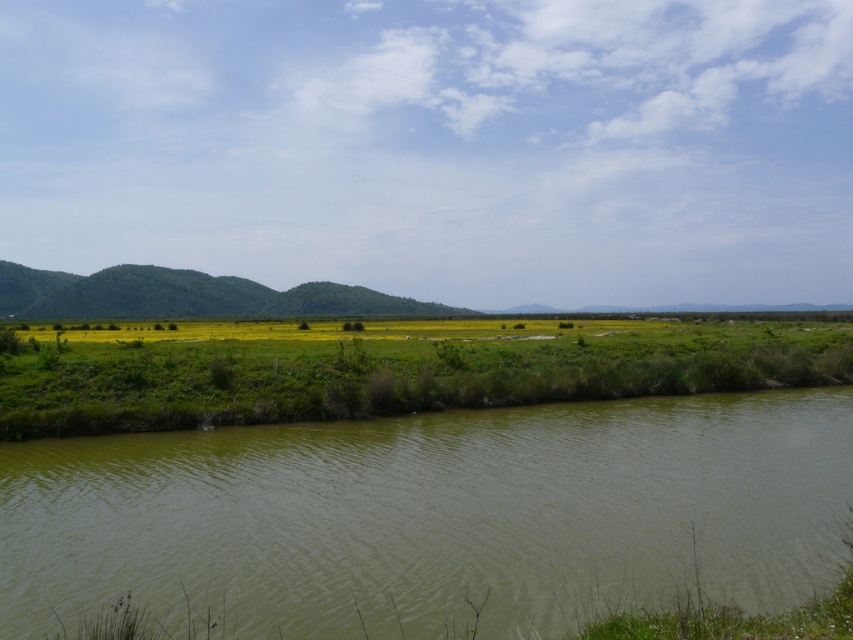
Between green muddy water at lower left and green grassy hill at center, which one has less height?

green muddy water at lower left is shorter.

Does green muddy water at lower left have a lesser width compared to green grassy hill at center?

Yes, green muddy water at lower left is thinner than green grassy hill at center.

Measure the distance between point (381, 490) and camera.

Point (381, 490) and camera are 19.40 meters apart.

The width and height of the screenshot is (853, 640). I want to click on green muddy water at lower left, so click(x=433, y=515).

This screenshot has height=640, width=853. What do you see at coordinates (392, 374) in the screenshot?
I see `green grassy wetland at center` at bounding box center [392, 374].

Does green grassy wetland at center have a greater height compared to green grassy hill at center?

No.

This screenshot has height=640, width=853. What do you see at coordinates (392, 374) in the screenshot? I see `green grassy wetland at center` at bounding box center [392, 374].

Find the location of a particular element. The height and width of the screenshot is (640, 853). green grassy wetland at center is located at coordinates (392, 374).

Can you confirm if green muddy water at lower left is wider than green grassy wetland at center?

In fact, green muddy water at lower left might be narrower than green grassy wetland at center.

This screenshot has height=640, width=853. Describe the element at coordinates (433, 515) in the screenshot. I see `green muddy water at lower left` at that location.

Who is more distant from viewer, [38,504] or [77,358]?

Point [77,358]

Find the location of a particular element. Image resolution: width=853 pixels, height=640 pixels. green muddy water at lower left is located at coordinates (433, 515).